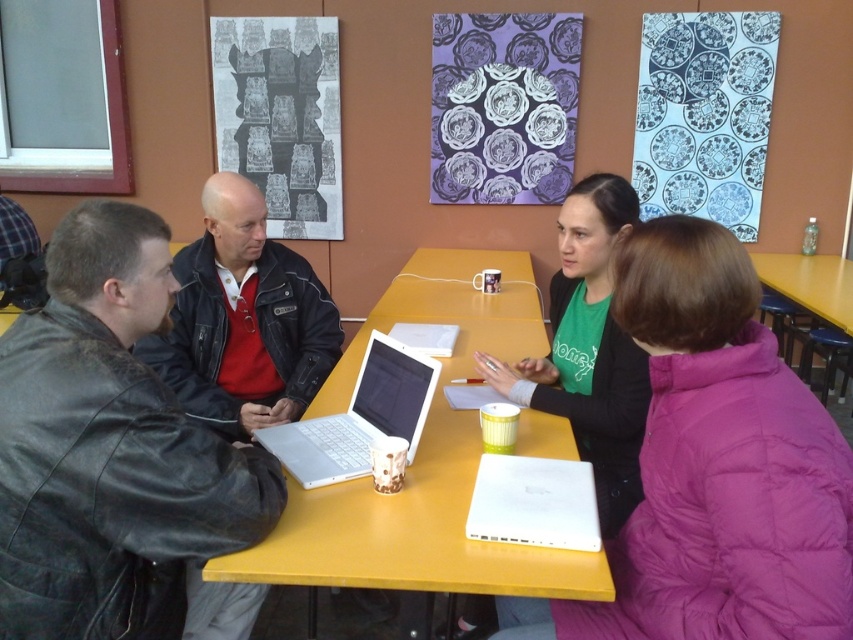
Which is above, purple puffy jacket at lower right or yellow plastic table at lower right?

Positioned higher is yellow plastic table at lower right.

Is purple puffy jacket at lower right positioned in front of yellow plastic table at lower right?

That is True.

What do you see at coordinates (715, 467) in the screenshot? I see `purple puffy jacket at lower right` at bounding box center [715, 467].

At what (x,y) coordinates should I click in order to perform the action: click on purple puffy jacket at lower right. Please return your answer as a coordinate pair (x, y). This screenshot has height=640, width=853. Looking at the image, I should click on (715, 467).

Is leather jacket at center to the left of white matte laptop at lower center from the viewer's perspective?

Indeed, leather jacket at center is positioned on the left side of white matte laptop at lower center.

Who is more distant from viewer, (186, 337) or (534, 528)?

The point (186, 337) is behind.

The height and width of the screenshot is (640, 853). In order to click on leather jacket at center in this screenshot , I will do pos(242,321).

Consider the image. Is yellow matte table at center further to the viewer compared to white plastic laptop at center?

No, it is not.

Locate an element on the screen. This screenshot has height=640, width=853. yellow matte table at center is located at coordinates (422, 461).

Is point (392, 573) positioned after point (375, 378)?

No, it is in front of (375, 378).

The image size is (853, 640). In order to click on yellow matte table at center in this screenshot , I will do `click(422, 461)`.